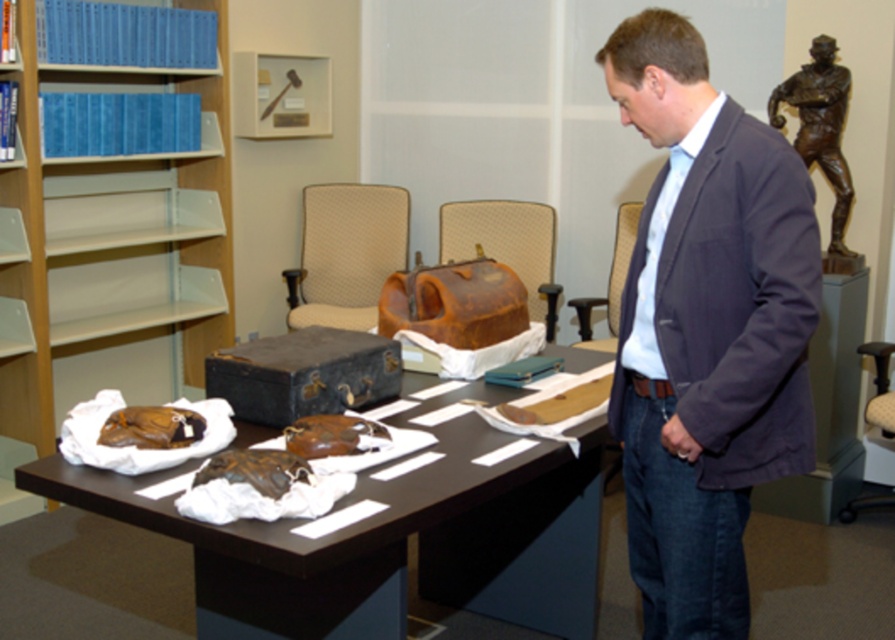
Looking at this image, between brown leather gloves at center and bronze statue at upper right, which one has more height?

bronze statue at upper right is taller.

Describe the element at coordinates (390, 540) in the screenshot. I see `brown leather gloves at center` at that location.

Where is `brown leather gloves at center`? The width and height of the screenshot is (895, 640). brown leather gloves at center is located at coordinates (390, 540).

Based on the photo, which of these two, dark gray blazer at center or blue plastic bookshelf at left, stands taller?

With more height is blue plastic bookshelf at left.

Where is `dark gray blazer at center`? This screenshot has height=640, width=895. dark gray blazer at center is located at coordinates (706, 330).

Can you confirm if dark gray blazer at center is thinner than brown leather gloves at center?

Indeed, dark gray blazer at center has a lesser width compared to brown leather gloves at center.

At what (x,y) coordinates should I click in order to perform the action: click on dark gray blazer at center. Please return your answer as a coordinate pair (x, y). Looking at the image, I should click on (706, 330).